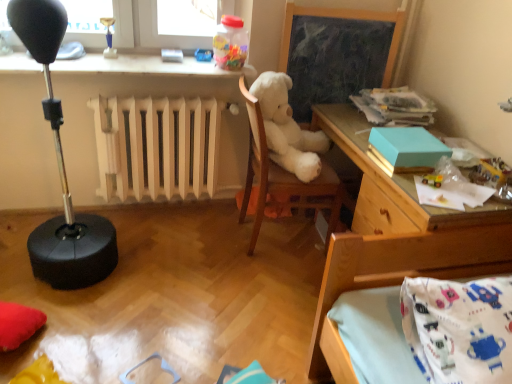
Image resolution: width=512 pixels, height=384 pixels. I want to click on free area below teal matte box at upper right (from a real-world perspective), so click(x=403, y=159).